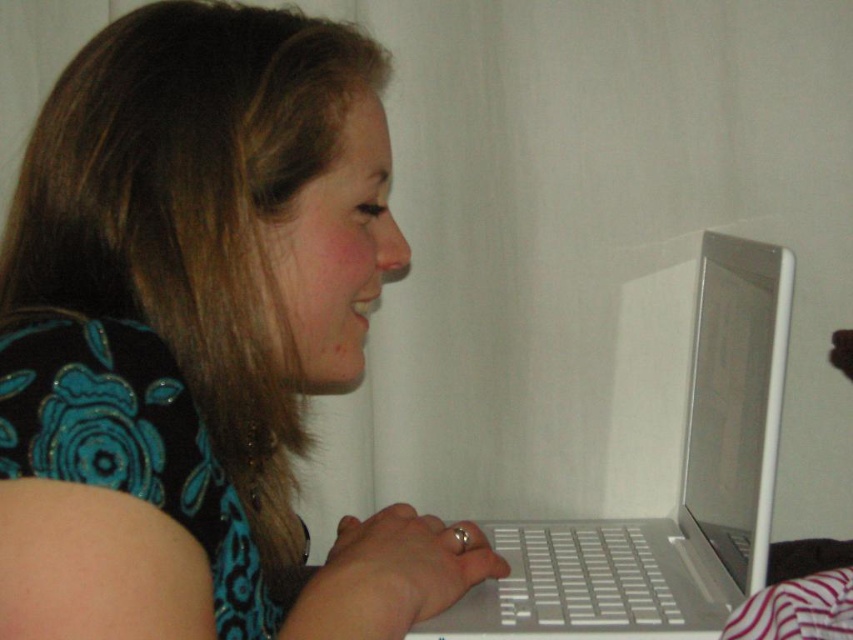
Question: Can you confirm if blue floral dress at center is thinner than white plastic laptop at center?

Choices:
 (A) no
 (B) yes

Answer: (A)

Question: Where is blue floral dress at center located in relation to white plastic laptop at center in the image?

Choices:
 (A) right
 (B) left

Answer: (B)

Question: Which point is closer to the camera taking this photo?

Choices:
 (A) (642, 630)
 (B) (260, 138)

Answer: (B)

Question: Does blue floral dress at center lie behind white glossy laptop at center?

Choices:
 (A) no
 (B) yes

Answer: (A)

Question: Which of the following is the farthest from the observer?

Choices:
 (A) white plastic laptop at center
 (B) white glossy laptop at center
 (C) blue floral dress at center

Answer: (B)

Question: Estimate the real-world distances between objects in this image. Which object is closer to the blue floral dress at center?

Choices:
 (A) white plastic laptop at center
 (B) white glossy laptop at center

Answer: (A)